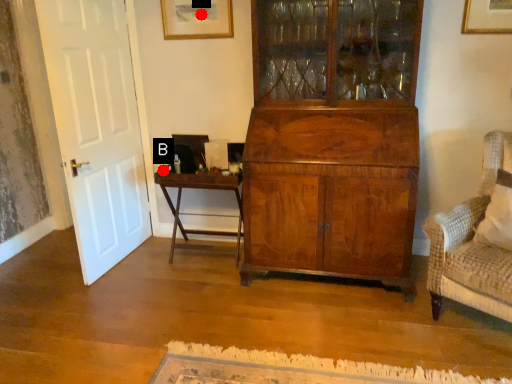
Question: Two points are circled on the image, labeled by A and B beside each circle. Which of the following is the farthest from the observer?

Choices:
 (A) A is further
 (B) B is further

Answer: (B)